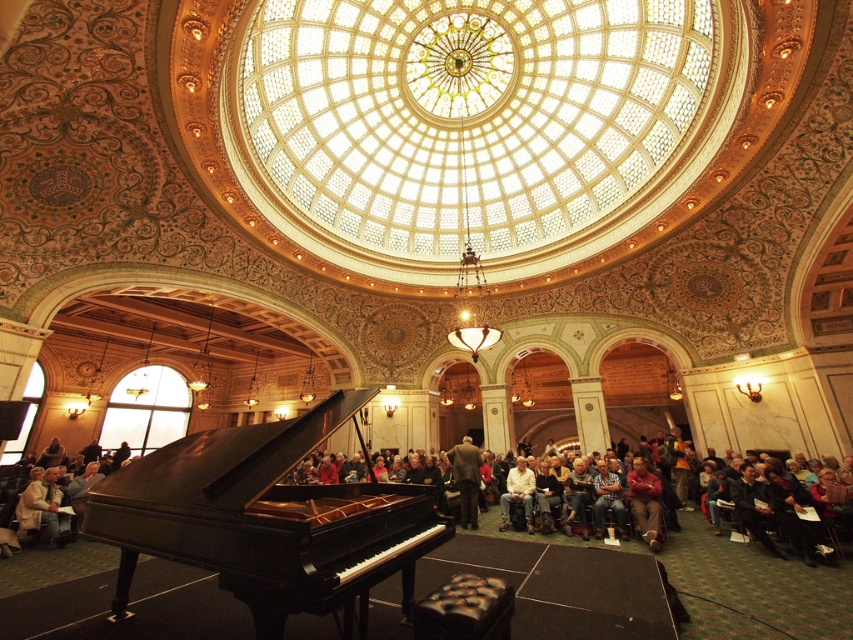
Does high-gloss black piano at center appear on the right side of red velvet coat at lower center?

In fact, high-gloss black piano at center is to the left of red velvet coat at lower center.

Is point (216, 493) positioned in front of point (643, 484)?

Yes, point (216, 493) is closer to viewer.

Where is `high-gloss black piano at center`? The image size is (853, 640). high-gloss black piano at center is located at coordinates (268, 518).

Is high-gloss black piano at center shorter than dark brown leather jacket at center?

No.

Between point (154, 536) and point (463, 480), which one is positioned behind?

Point (463, 480)

What do you see at coordinates (268, 518) in the screenshot? Image resolution: width=853 pixels, height=640 pixels. I see `high-gloss black piano at center` at bounding box center [268, 518].

Where is `high-gloss black piano at center`? Image resolution: width=853 pixels, height=640 pixels. high-gloss black piano at center is located at coordinates (268, 518).

Between point (641, 497) and point (474, 520), which one is positioned in front?

Point (641, 497) is more forward.

Is red velvet coat at lower center bigger than dark brown leather jacket at center?

No.

Find the location of a particular element. This screenshot has width=853, height=640. red velvet coat at lower center is located at coordinates (645, 500).

Image resolution: width=853 pixels, height=640 pixels. I want to click on red velvet coat at lower center, so click(645, 500).